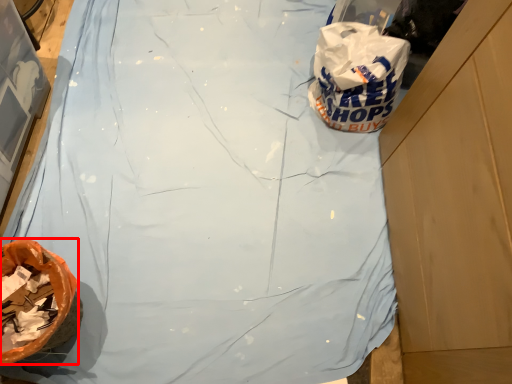
Question: Observing the image, what is the correct spatial positioning of waste (annotated by the red box) in reference to plastic bag?

Choices:
 (A) right
 (B) left

Answer: (B)